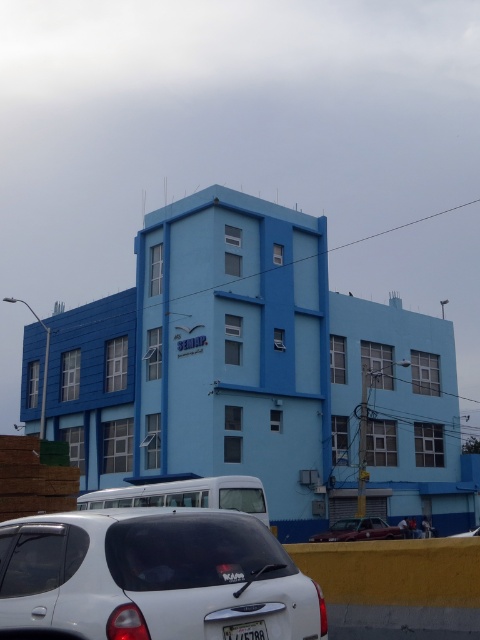
You are a delivery person trying to park your van in the parking lot behind the light blue building. You see a shiny red car at center and a metallic silver sedan at center. Which car should you move to access the parking spot behind them?

The shiny red car at center is in front of the metallic silver sedan at center, so you should move the shiny red car at center first to access the parking spot behind them.

You are standing 10 feet away from the camera. Can you see the entire white matte hatchback at lower center from your current position?

The white matte hatchback at lower center is 11.56 feet away from the camera. Since you are standing 10 feet away from the camera, you are closer to the camera than the car. Therefore, you can see the entire white matte hatchback at lower center from your current position.

Consider the image. You are a delivery driver who needs to park your white matte hatchback at lower center in a parking spot that can only accommodate vehicles up to the size of the white plastic license plate at lower center. Can your vehicle fit in the parking spot?

The white matte hatchback at lower center is larger than the white plastic license plate at lower center, so it cannot fit in the parking spot designed for vehicles up to the license plate size.